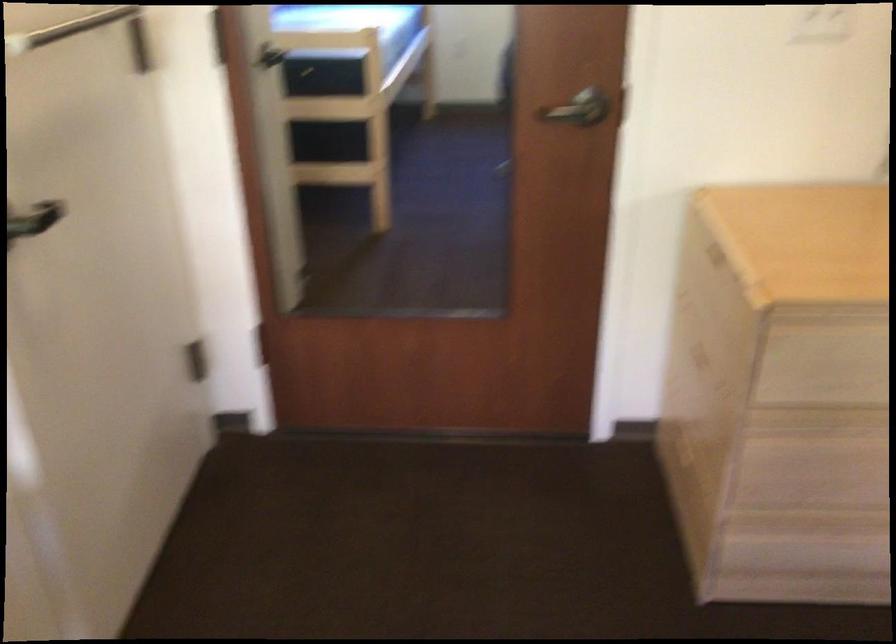
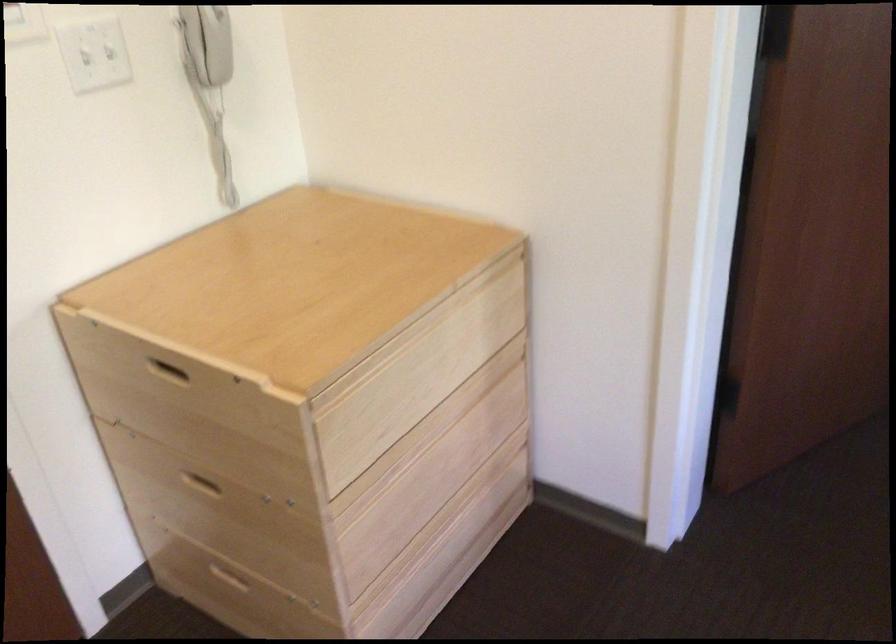
Question: Based on the continuous images, in which direction is the camera rotating? Reply with the corresponding letter.

Choices:
 (A) Left
 (B) Right
 (C) Up
 (D) Down

Answer: (B)